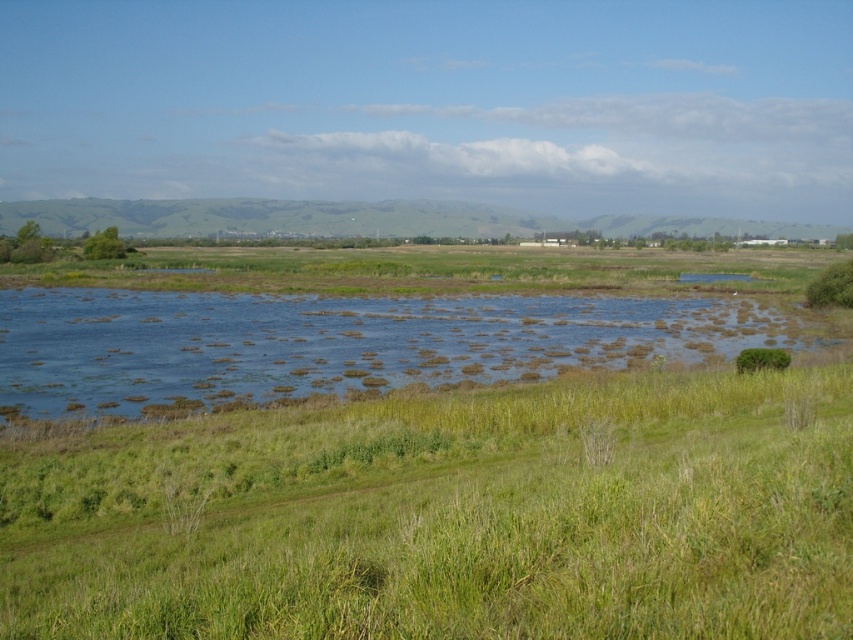
You are standing at the edge of the green grassy at lower left and want to cross to the blue grassy river at center. Is the path directly ahead clear of obstacles?

The green grassy at lower left is in front of the blue grassy river at center, so there are no obstacles blocking the path directly ahead between the green grassy at lower left and the blue grassy river at center.

You are standing at the point labeled as point (448, 515) in the image. What type of vegetation is directly beneath your feet?

The point (448, 515) corresponds to the green grassy area at lower left, so the vegetation beneath your feet is green grassy.